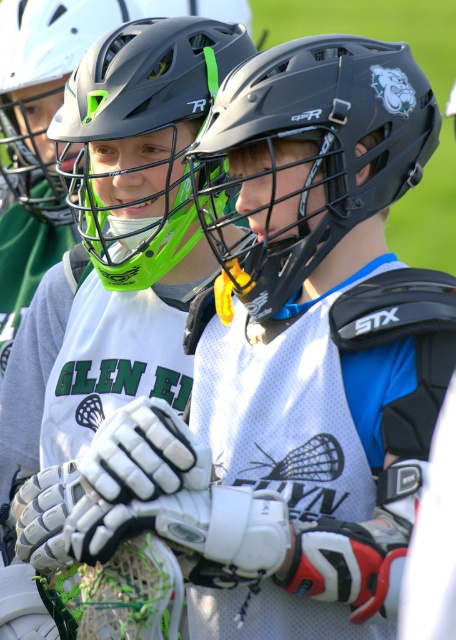
Does white matte lacrosse glove at center have a lesser width compared to matte black helmet at upper center?

In fact, white matte lacrosse glove at center might be wider than matte black helmet at upper center.

Is white matte lacrosse glove at center bigger than matte black helmet at upper center?

Indeed, white matte lacrosse glove at center has a larger size compared to matte black helmet at upper center.

Between point (43, 355) and point (82, 237), which one is positioned behind?

The point (43, 355) is behind.

Locate an element on the screen. The height and width of the screenshot is (640, 456). white matte lacrosse glove at center is located at coordinates (118, 253).

Is white matte lacrosse glove at center above black matte helmet at center?

No, white matte lacrosse glove at center is not above black matte helmet at center.

Is the position of white matte lacrosse glove at center more distant than that of black matte helmet at center?

Yes, white matte lacrosse glove at center is further from the viewer.

This screenshot has width=456, height=640. In order to click on white matte lacrosse glove at center in this screenshot , I will do `click(118, 253)`.

This screenshot has height=640, width=456. What do you see at coordinates (311, 156) in the screenshot? I see `black matte helmet at center` at bounding box center [311, 156].

Who is more forward, (222, 125) or (125, 28)?

Positioned in front is point (222, 125).

Between point (317, 257) and point (231, 45), which one is positioned behind?

The point (231, 45) is behind.

I want to click on black matte helmet at center, so click(311, 156).